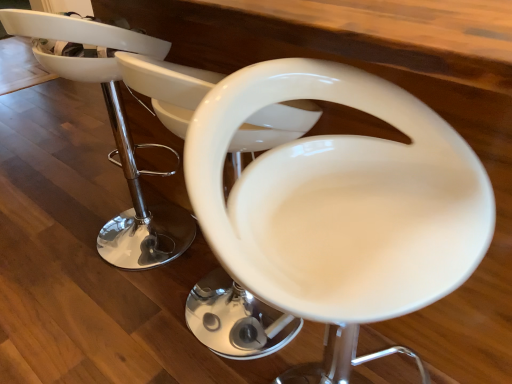
You are a GUI agent. You are given a task and a screenshot of the screen. Output one action in this format:
    pyautogui.click(x=<x>, y=<y>)
    Task: Click on the empty space that is in between white glossy bar stool at center, which is the 1th feeding chair from back to front, and white glossy bar stool at center
    This screenshot has width=512, height=384.
    Given the screenshot: What is the action you would take?
    pyautogui.click(x=173, y=273)